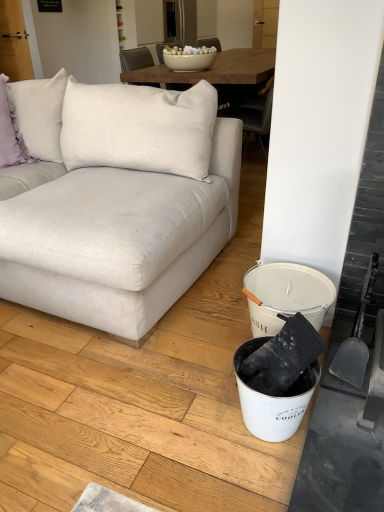
Question: From a real-world perspective, is white fabric couch at left above or below white matte bucket at lower right?

Choices:
 (A) below
 (B) above

Answer: (B)

Question: From the image's perspective, is white fabric couch at left positioned above or below white matte bucket at lower right?

Choices:
 (A) below
 (B) above

Answer: (B)

Question: Which object is the farthest from the lavender fabric pillow at upper left?

Choices:
 (A) gray plastic shovel at right
 (B) white matte bucket at lower right
 (C) white fabric couch at left

Answer: (A)

Question: Based on their relative distances, which object is farther from the white matte bucket at lower right?

Choices:
 (A) white fabric couch at left
 (B) lavender fabric pillow at upper left
 (C) gray plastic shovel at right

Answer: (B)